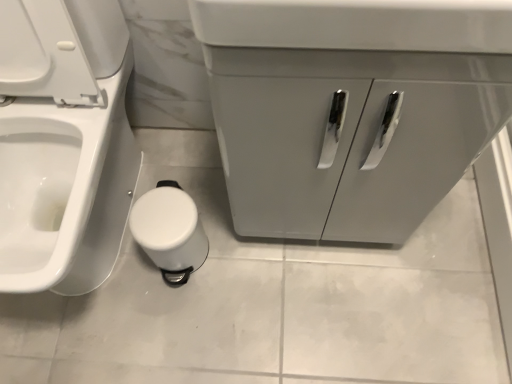
This screenshot has width=512, height=384. Find the location of `vacant space in between white glossy toilet at lower left and matte gray cabinet at center`. vacant space in between white glossy toilet at lower left and matte gray cabinet at center is located at coordinates (223, 224).